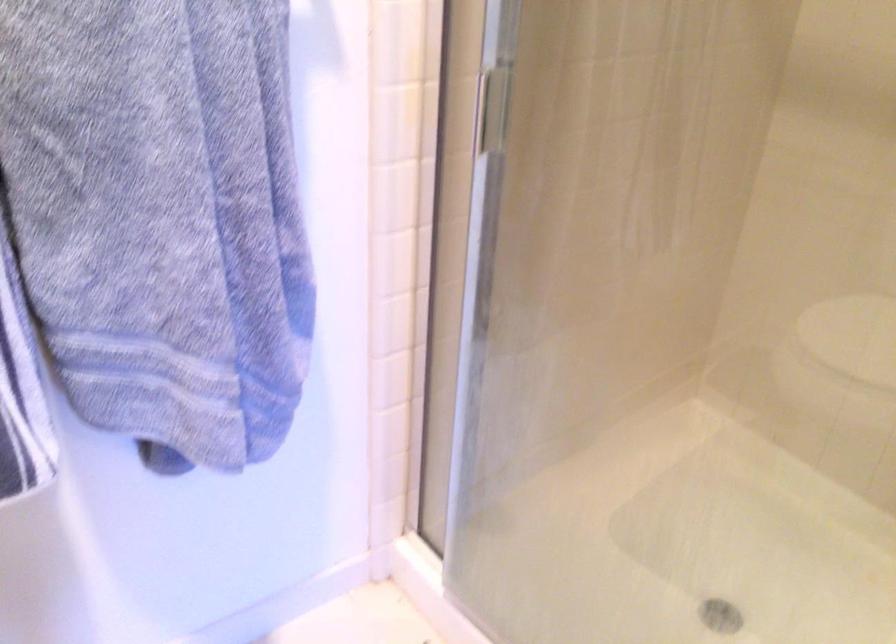
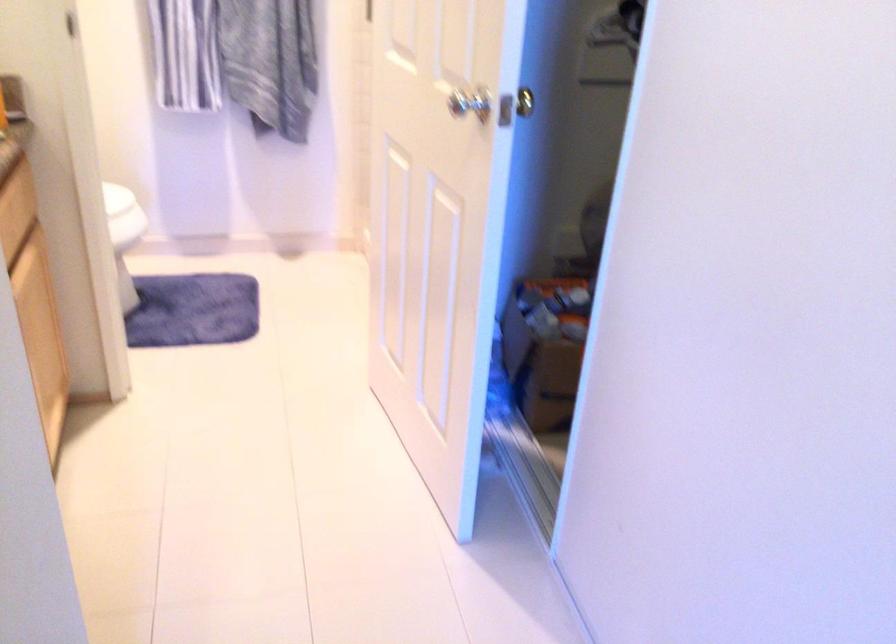
Which direction would the cameraman need to move to produce the second image?

The cameraman walked toward right, backward.